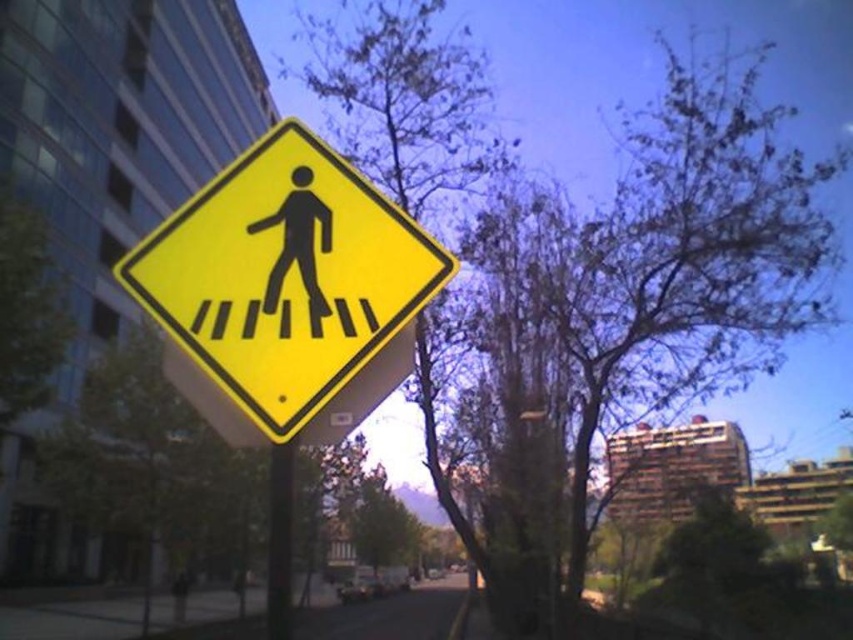
Question: Which point appears closest to the camera in this image?

Choices:
 (A) (276, 563)
 (B) (309, 292)

Answer: (A)

Question: Does yellow matte pedestrian crossing sign at center come in front of black silhouette at center?

Choices:
 (A) yes
 (B) no

Answer: (A)

Question: Observing the image, what is the correct spatial positioning of black silhouette at center in reference to black plastic pole at center?

Choices:
 (A) right
 (B) left

Answer: (A)

Question: Which object appears farthest from the camera in this image?

Choices:
 (A) black plastic pole at center
 (B) black silhouette at center

Answer: (B)

Question: Among these points, which one is nearest to the camera?

Choices:
 (A) (271, 563)
 (B) (297, 202)
 (C) (244, 289)

Answer: (A)

Question: Observing the image, what is the correct spatial positioning of black silhouette at center in reference to black plastic pole at center?

Choices:
 (A) right
 (B) left

Answer: (A)